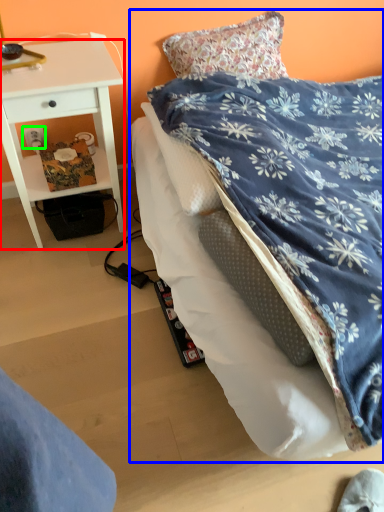
Question: Based on their relative distances, which object is farther from desk (highlighted by a red box)? Choose from bed (highlighted by a blue box) and power outlet (highlighted by a green box).

Choices:
 (A) bed
 (B) power outlet

Answer: (A)